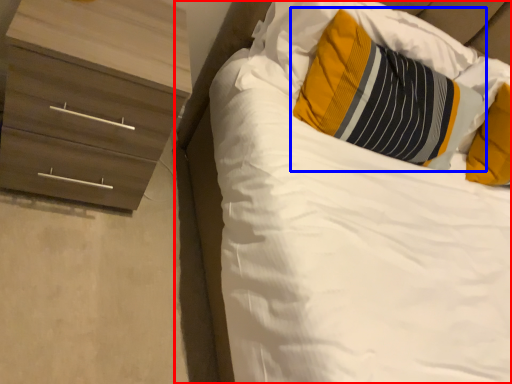
Question: Which point is closer to the camera, bed (highlighted by a red box) or pillow (highlighted by a blue box)?

Choices:
 (A) bed
 (B) pillow

Answer: (A)